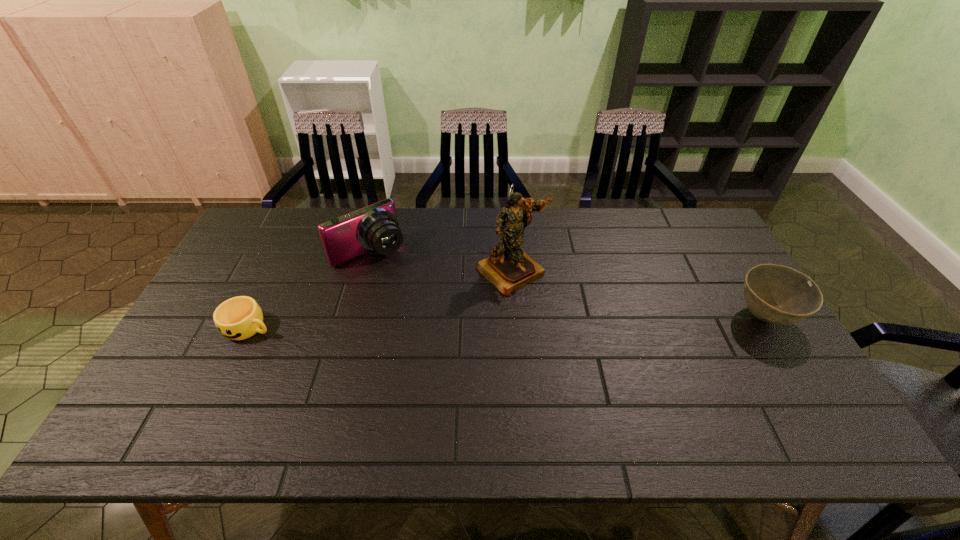
At what (x,y) coordinates should I click in order to perform the action: click on free space on the desktop that is between the shortest object and the bowl and is positioned on the front-facing side of the figurine. Please return your answer as a coordinate pair (x, y). Image resolution: width=960 pixels, height=540 pixels. Looking at the image, I should click on (564, 321).

Find the location of a particular element. The height and width of the screenshot is (540, 960). vacant space on the desktop that is between the cup and the third tallest object and is positioned on the front-facing side of the second object from left to right is located at coordinates (433, 323).